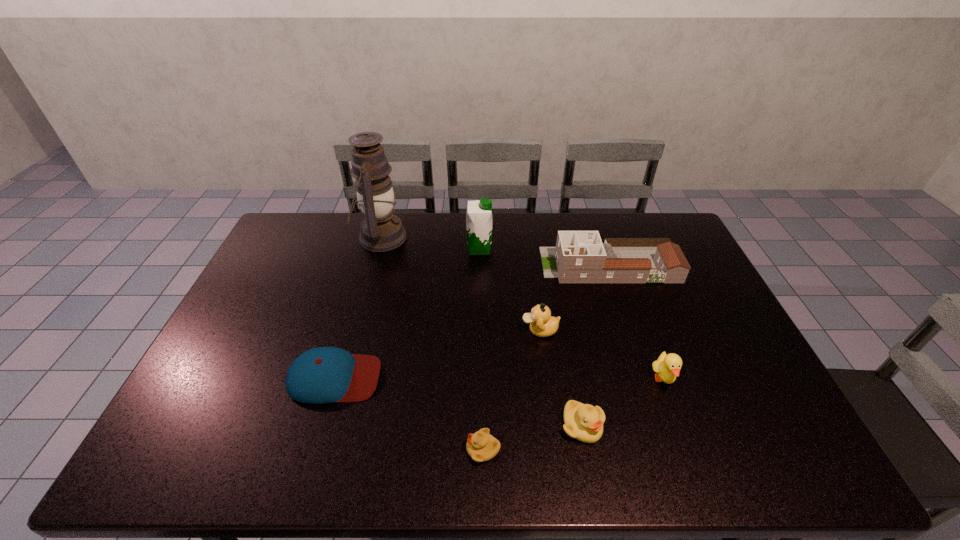
You are a GUI agent. You are given a task and a screenshot of the screen. Output one action in this format:
    pyautogui.click(x=<x>, y=<y>)
    Task: Click on the vacant space at the right edge
    This screenshot has width=960, height=540.
    Given the screenshot: What is the action you would take?
    pyautogui.click(x=697, y=294)

Locate an element on the screen. The height and width of the screenshot is (540, 960). vacant position at the far right corner of the desktop is located at coordinates (653, 217).

Where is `vacant space at the near right corner of the desktop`? vacant space at the near right corner of the desktop is located at coordinates pos(743,446).

The width and height of the screenshot is (960, 540). In order to click on vacant space in between the second shortest duckling and the fifth nearest object in this screenshot , I will do `click(561, 378)`.

Identify the location of free space between the tallest object and the dollhouse. The width and height of the screenshot is (960, 540). (494, 251).

The image size is (960, 540). I want to click on vacant space that's between the sixth shortest object and the third tallest duckling, so click(595, 346).

Identify the location of free space between the farthest duckling and the third tallest duckling. (561, 378).

The height and width of the screenshot is (540, 960). I want to click on vacant space that's between the dollhouse and the oil lamp, so click(x=494, y=251).

I want to click on vacant space that's between the third tallest object and the tallest object, so click(494, 251).

At what (x,y) coordinates should I click in order to perform the action: click on free spot between the shortest object and the dollhouse. Please return your answer as a coordinate pair (x, y). Image resolution: width=960 pixels, height=540 pixels. Looking at the image, I should click on (546, 357).